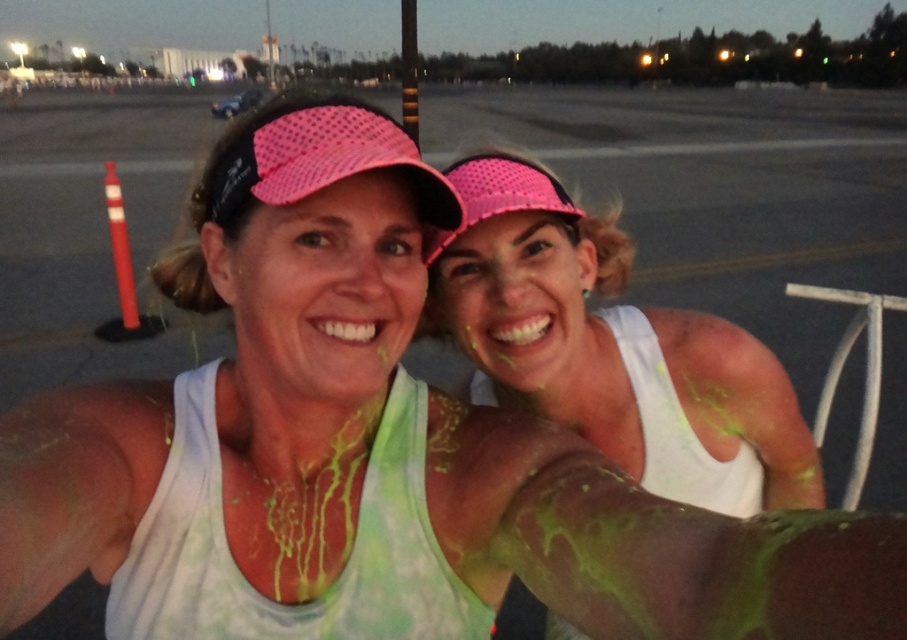
Is point (798, 436) farther from viewer compared to point (340, 396)?

Yes, it is behind point (340, 396).

Locate an element on the screen. This screenshot has height=640, width=907. pink mesh visor at upper center is located at coordinates (610, 348).

Measure the distance between pink mesh visor at upper center and camera.

pink mesh visor at upper center and camera are 32.31 inches apart from each other.

You are a GUI agent. You are given a task and a screenshot of the screen. Output one action in this format:
    pyautogui.click(x=<x>, y=<y>)
    Task: Click on the pink mesh visor at upper center
    
    Given the screenshot: What is the action you would take?
    pyautogui.click(x=610, y=348)

Does point (353, 196) come closer to viewer compared to point (490, 248)?

Yes, point (353, 196) is closer to viewer.

Who is more distant from viewer, (339, 371) or (486, 369)?

The point (486, 369) is behind.

Does point (346, 369) come closer to viewer compared to point (486, 253)?

Yes, point (346, 369) is closer to viewer.

What are the coordinates of `matte pink cap at center` in the screenshot? It's located at (322, 291).

Between point (476, 307) and point (515, 337), which one is positioned in front?

Point (515, 337) is more forward.

The width and height of the screenshot is (907, 640). What do you see at coordinates (610, 348) in the screenshot?
I see `pink mesh visor at upper center` at bounding box center [610, 348].

At what (x,y) coordinates should I click in order to perform the action: click on pink mesh visor at upper center. Please return your answer as a coordinate pair (x, y). The height and width of the screenshot is (640, 907). Looking at the image, I should click on (610, 348).